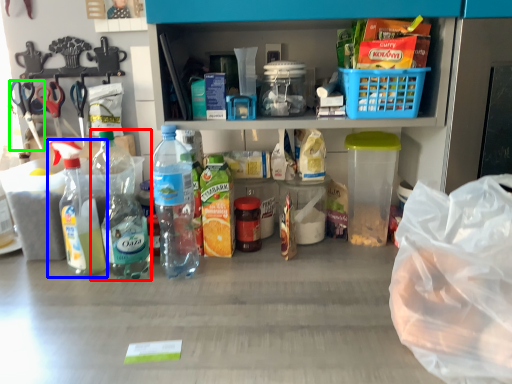
Question: Estimate the real-world distances between objects in this image. Which object is closer to bottle (highlighted by a red box), bottle (highlighted by a blue box) or scissors (highlighted by a green box)?

Choices:
 (A) bottle
 (B) scissors

Answer: (A)